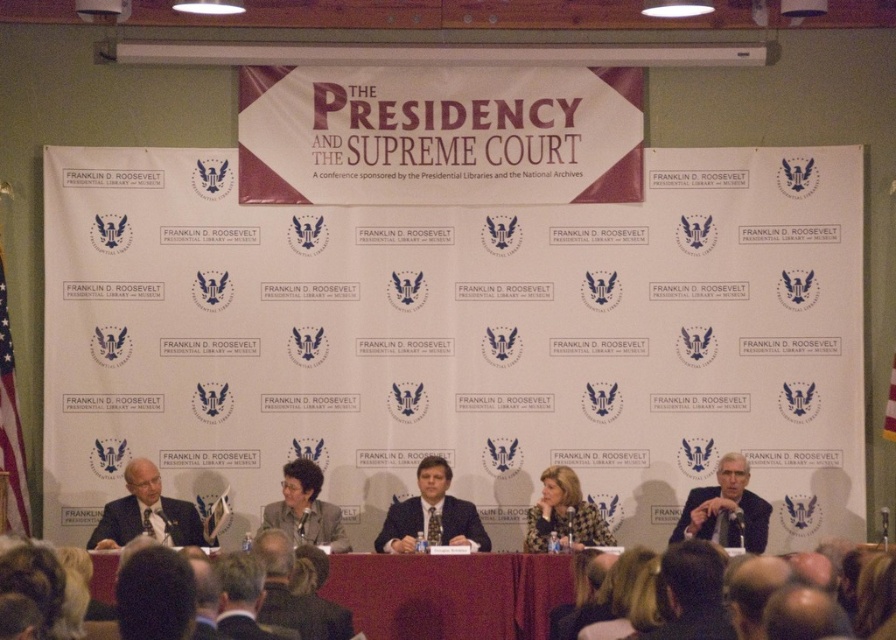
You are a photographer at the event and need to capture both the matte black suit at left and the patterned fabric jacket at center in a single frame. Given their sizes, which one should you zoom in on to ensure both are clearly visible without cropping?

The matte black suit at left is smaller in size compared to the patterned fabric jacket at center. To ensure both are clearly visible without cropping, you should zoom out slightly to accommodate the larger size of the patterned fabric jacket at center while still capturing the smaller matte black suit at left in the frame.